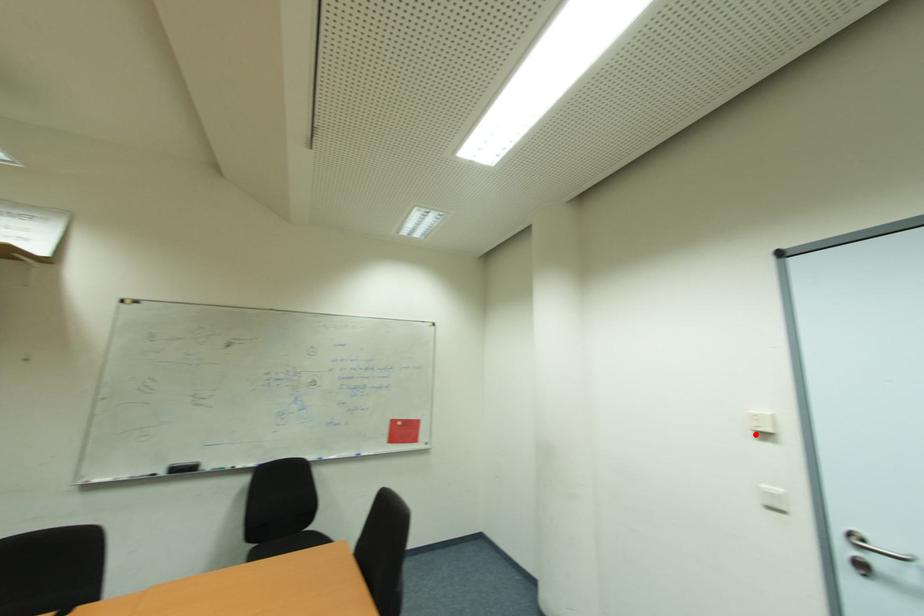
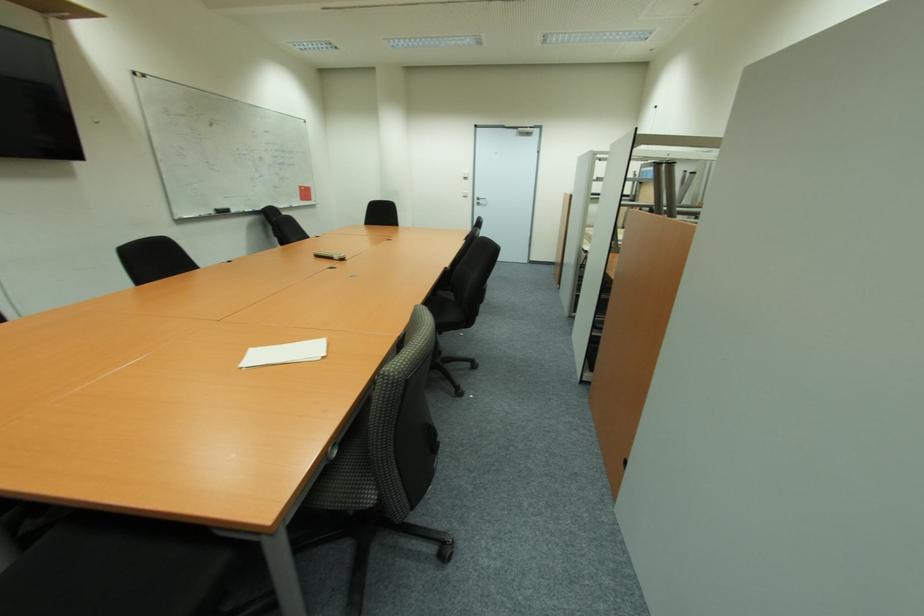
Where in the second image is the point corresponding to the highlighted location from the first image?

(467, 179)